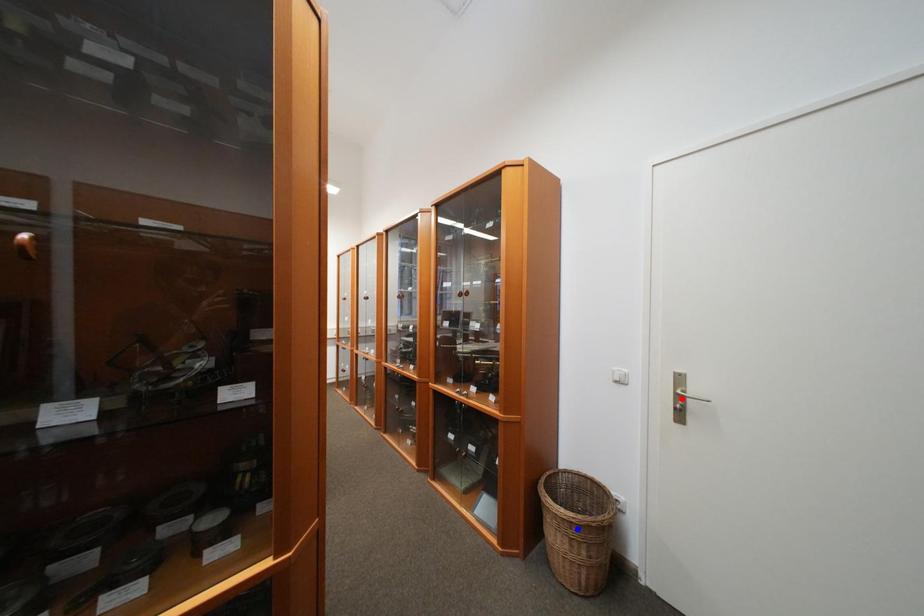
Question: Two points are marked on the image. Which point is closer to the camera?

Choices:
 (A) Blue point is closer.
 (B) Red point is closer.

Answer: (B)